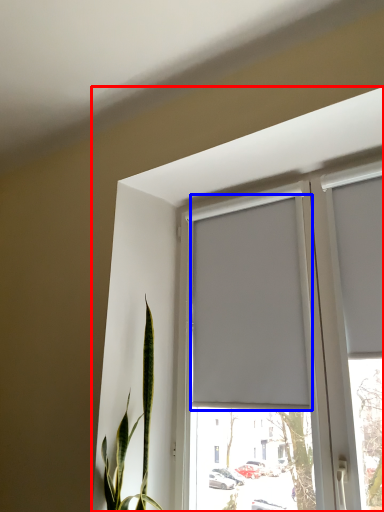
Question: Which object is closer to the camera taking this photo, window (highlighted by a red box) or curtain (highlighted by a blue box)?

Choices:
 (A) window
 (B) curtain

Answer: (A)